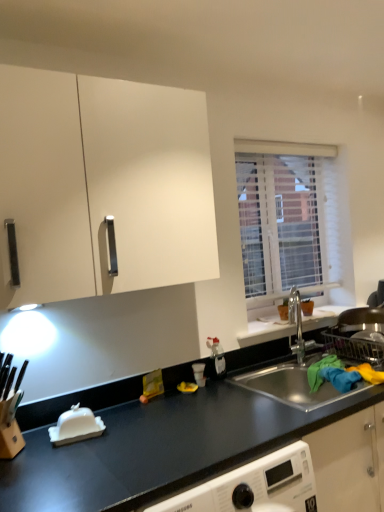
Question: Considering the relative positions of white matte cabinet at upper left and white textured blinds at upper right in the image provided, is white matte cabinet at upper left to the left of white textured blinds at upper right from the viewer's perspective?

Choices:
 (A) yes
 (B) no

Answer: (A)

Question: Can you confirm if white matte cabinet at upper left is smaller than white textured blinds at upper right?

Choices:
 (A) no
 (B) yes

Answer: (A)

Question: Can white textured blinds at upper right be found inside white matte cabinet at upper left?

Choices:
 (A) yes
 (B) no

Answer: (B)

Question: Is white matte cabinet at upper left with white textured blinds at upper right?

Choices:
 (A) yes
 (B) no

Answer: (B)

Question: From a real-world perspective, is white matte cabinet at upper left beneath white textured blinds at upper right?

Choices:
 (A) yes
 (B) no

Answer: (B)

Question: Could you tell me if white matte cabinet at upper left is turned towards white textured blinds at upper right?

Choices:
 (A) yes
 (B) no

Answer: (B)

Question: Can you confirm if white textured blinds at upper right is smaller than black matte countertop at center?

Choices:
 (A) yes
 (B) no

Answer: (A)

Question: From a real-world perspective, does white textured blinds at upper right stand above black matte countertop at center?

Choices:
 (A) yes
 (B) no

Answer: (A)

Question: From the image's perspective, is white textured blinds at upper right beneath black matte countertop at center?

Choices:
 (A) yes
 (B) no

Answer: (B)

Question: Is white textured blinds at upper right closer to camera compared to black matte countertop at center?

Choices:
 (A) yes
 (B) no

Answer: (B)

Question: Can you confirm if white textured blinds at upper right is thinner than black matte countertop at center?

Choices:
 (A) no
 (B) yes

Answer: (B)

Question: From a real-world perspective, is white textured blinds at upper right under black matte countertop at center?

Choices:
 (A) yes
 (B) no

Answer: (B)

Question: Is white textured blinds at upper right at the left side of white matte cabinet at upper left?

Choices:
 (A) yes
 (B) no

Answer: (B)